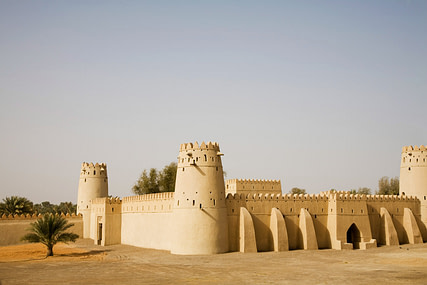
Where is `wall`? wall is located at coordinates (25, 227), (146, 217), (314, 206), (387, 204).